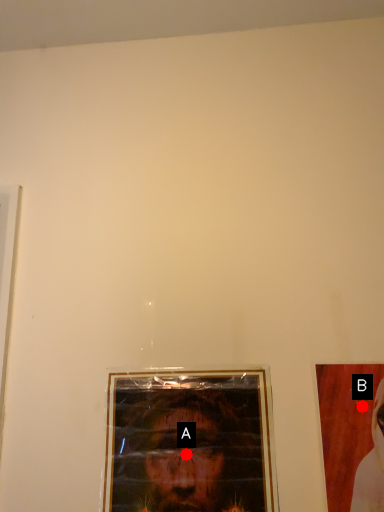
Question: Two points are circled on the image, labeled by A and B beside each circle. Which point is further to the camera?

Choices:
 (A) A is further
 (B) B is further

Answer: (A)